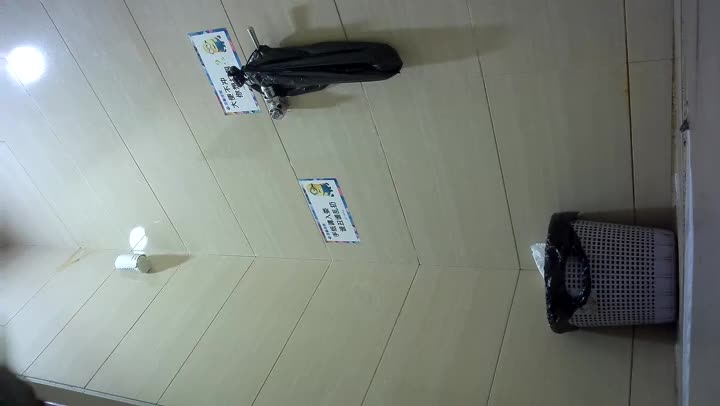
The image size is (720, 406). I want to click on hook, so click(x=278, y=107).